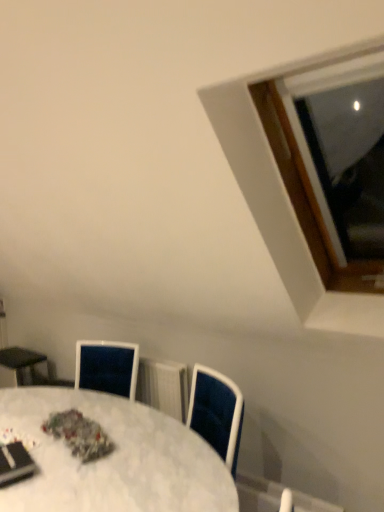
This screenshot has width=384, height=512. Identify the location of white marble table at center. (114, 459).

Describe the element at coordinates (114, 459) in the screenshot. The image size is (384, 512). I see `white marble table at center` at that location.

Measure the distance between point (x=67, y=459) and camera.

They are 1.54 meters apart.

The height and width of the screenshot is (512, 384). Find the location of `white marble table at center`. white marble table at center is located at coordinates (114, 459).